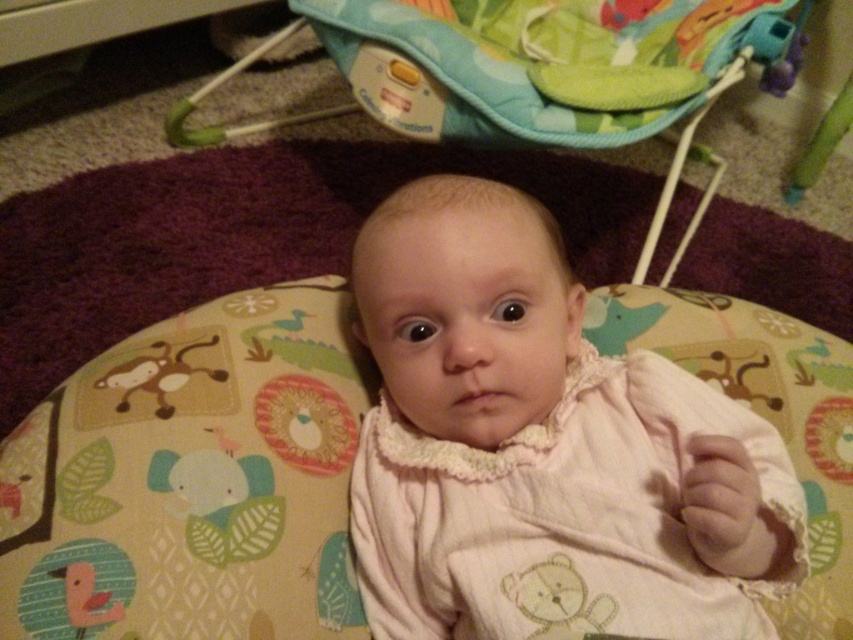
Question: Considering the real-world distances, which object is closest to the soft fabric baby bed at center?

Choices:
 (A) white textured fabric at center
 (B) multicolored fabric baby carriage at center

Answer: (A)

Question: Can you confirm if white textured fabric at center is wider than soft fabric baby bed at center?

Choices:
 (A) yes
 (B) no

Answer: (A)

Question: Is soft fabric baby bed at center to the left of multicolored fabric baby carriage at center from the viewer's perspective?

Choices:
 (A) yes
 (B) no

Answer: (A)

Question: Which object appears farthest from the camera in this image?

Choices:
 (A) white textured fabric at center
 (B) soft fabric baby bed at center

Answer: (B)

Question: Can you confirm if white textured fabric at center is smaller than soft fabric baby bed at center?

Choices:
 (A) no
 (B) yes

Answer: (B)

Question: Which of the following is the farthest from the observer?

Choices:
 (A) (596, 429)
 (B) (634, 20)

Answer: (B)